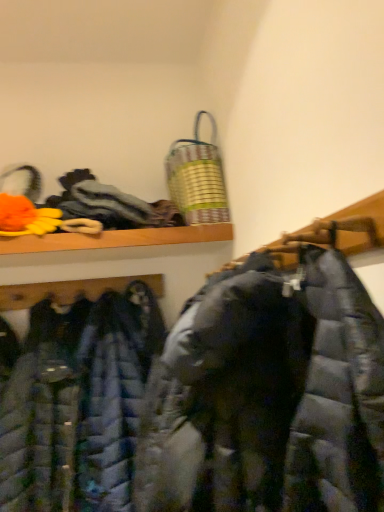
Describe the element at coordinates (241, 381) in the screenshot. The image size is (384, 512). I see `matte black puffer coat at center, which is the 2th cloak from top to bottom` at that location.

The width and height of the screenshot is (384, 512). What are the coordinates of `textured gray cloth at upper left, which is the first cloak in top-to-bottom order` in the screenshot? It's located at (110, 204).

Considering the positions of objects metallic striped laundry basket at upper center and matte blue puffer jacket at center, placed as the second jacket when sorted from front to back, in the image provided, who is more to the right, metallic striped laundry basket at upper center or matte blue puffer jacket at center, placed as the second jacket when sorted from front to back,?

metallic striped laundry basket at upper center.

Is point (210, 199) positioned before point (78, 498)?

No, it is not.

Is metallic striped laundry basket at upper center outside of matte blue puffer jacket at center, placed as the second jacket when sorted from front to back?

Yes, metallic striped laundry basket at upper center is outside of matte blue puffer jacket at center, placed as the second jacket when sorted from front to back.

Can you see metallic striped laundry basket at upper center touching matte blue puffer jacket at center, the 1th jacket in the back-to-front sequence?

No, metallic striped laundry basket at upper center is not next to matte blue puffer jacket at center, the 1th jacket in the back-to-front sequence.

From the image's perspective, is matte black puffer jacket at center, which appears as the first jacket when viewed from the front, below matte black puffer coat at center, which is the 2th cloak from top to bottom?

Actually, matte black puffer jacket at center, which appears as the first jacket when viewed from the front, appears above matte black puffer coat at center, which is the 2th cloak from top to bottom, in the image.

Considering the relative sizes of matte black puffer jacket at center, which appears as the first jacket when viewed from the front, and matte black puffer coat at center, which is the 2th cloak from top to bottom, in the image provided, is matte black puffer jacket at center, which appears as the first jacket when viewed from the front, smaller than matte black puffer coat at center, which is the 2th cloak from top to bottom,?

No.

Between matte black puffer jacket at center, which appears as the first jacket when viewed from the front, and matte black puffer coat at center, which is the 2th cloak from top to bottom, which one is positioned behind?

matte black puffer coat at center, which is the 2th cloak from top to bottom, is further from the camera.

Is point (209, 388) farther from viewer compared to point (72, 349)?

No, it is in front of (72, 349).

From a real-world perspective, between matte black puffer jacket at center, which appears as the first jacket when viewed from the front, and matte blue puffer jacket at center, placed as the second jacket when sorted from front to back, who is vertically lower?

matte blue puffer jacket at center, placed as the second jacket when sorted from front to back, from a real-world perspective.

From the picture: Can we say matte black puffer jacket at center, which appears as the first jacket when viewed from the front, lies outside matte blue puffer jacket at center, the 1th jacket in the back-to-front sequence?

matte black puffer jacket at center, which appears as the first jacket when viewed from the front, lies outside matte blue puffer jacket at center, the 1th jacket in the back-to-front sequence,'s area.

Considering the positions of objects matte black puffer jacket at center, which appears as the first jacket when viewed from the front, and matte blue puffer jacket at center, the 1th jacket in the back-to-front sequence, in the image provided, who is behind, matte black puffer jacket at center, which appears as the first jacket when viewed from the front, or matte blue puffer jacket at center, the 1th jacket in the back-to-front sequence,?

Positioned behind is matte blue puffer jacket at center, the 1th jacket in the back-to-front sequence.

Is metallic striped laundry basket at upper center to the left or to the right of textured gray cloth at upper left, which is the first cloak in top-to-bottom order, in the image?

metallic striped laundry basket at upper center is to the right of textured gray cloth at upper left, which is the first cloak in top-to-bottom order.

Considering the sizes of metallic striped laundry basket at upper center and textured gray cloth at upper left, arranged as the second cloak when ordered from the bottom, in the image, is metallic striped laundry basket at upper center wider or thinner than textured gray cloth at upper left, arranged as the second cloak when ordered from the bottom,?

metallic striped laundry basket at upper center is thinner than textured gray cloth at upper left, arranged as the second cloak when ordered from the bottom.

Is textured gray cloth at upper left, arranged as the second cloak when ordered from the bottom, at the right side of metallic striped laundry basket at upper center?

Incorrect, textured gray cloth at upper left, arranged as the second cloak when ordered from the bottom, is not on the right side of metallic striped laundry basket at upper center.

Between textured gray cloth at upper left, arranged as the second cloak when ordered from the bottom, and metallic striped laundry basket at upper center, which one is positioned behind?

metallic striped laundry basket at upper center is further away from the camera.

Does textured gray cloth at upper left, which is the first cloak in top-to-bottom order, turn towards metallic striped laundry basket at upper center?

No, textured gray cloth at upper left, which is the first cloak in top-to-bottom order, is not oriented towards metallic striped laundry basket at upper center.

Is textured gray cloth at upper left, which is the first cloak in top-to-bottom order, positioned far away from metallic striped laundry basket at upper center?

That's not correct — textured gray cloth at upper left, which is the first cloak in top-to-bottom order, is a little close to metallic striped laundry basket at upper center.

At what (x,y) coordinates should I click in order to perform the action: click on the 2nd jacket in front of the textured gray cloth at upper left, which is the first cloak in top-to-bottom order, starting your count from the anchor. Please return your answer as a coordinate pair (x, y). Image resolution: width=384 pixels, height=512 pixels. Looking at the image, I should click on (201, 398).

Which object is wider, textured gray cloth at upper left, arranged as the second cloak when ordered from the bottom, or matte black puffer jacket at center, which appears as the second jacket when viewed from the back?

matte black puffer jacket at center, which appears as the second jacket when viewed from the back, is wider.

Could matte black puffer jacket at center, which appears as the second jacket when viewed from the back, be considered to be inside textured gray cloth at upper left, arranged as the second cloak when ordered from the bottom?

No, matte black puffer jacket at center, which appears as the second jacket when viewed from the back, is not a part of textured gray cloth at upper left, arranged as the second cloak when ordered from the bottom.

What's the angular difference between textured gray cloth at upper left, which is the first cloak in top-to-bottom order, and matte black puffer jacket at center, which appears as the first jacket when viewed from the front,'s facing directions?

92.5 degrees.

From a real-world perspective, relative to matte black puffer jacket at center, which appears as the first jacket when viewed from the front, is metallic striped laundry basket at upper center vertically above or below?

In terms of real-world spatial position, metallic striped laundry basket at upper center is above matte black puffer jacket at center, which appears as the first jacket when viewed from the front.

Which object is thinner, metallic striped laundry basket at upper center or matte black puffer jacket at center, which appears as the second jacket when viewed from the back?

metallic striped laundry basket at upper center is thinner.

At what (x,y) coordinates should I click in order to perform the action: click on jacket that is the 2nd one when counting downward from the metallic striped laundry basket at upper center (from the image's perspective). Please return your answer as a coordinate pair (x, y). Looking at the image, I should click on (76, 401).

You are a GUI agent. You are given a task and a screenshot of the screen. Output one action in this format:
    pyautogui.click(x=<x>, y=<y>)
    Task: Click on the jacket in front of the matte black puffer coat at center, the 1th cloak ordered from the bottom
    The width and height of the screenshot is (384, 512).
    Given the screenshot: What is the action you would take?
    pyautogui.click(x=201, y=398)

Looking at the image, which one is located closer to metallic striped laundry basket at upper center, matte blue puffer jacket at center, placed as the second jacket when sorted from front to back, or matte black puffer jacket at center, which appears as the second jacket when viewed from the back?

matte black puffer jacket at center, which appears as the second jacket when viewed from the back, is positioned closer to the anchor metallic striped laundry basket at upper center.

Considering their positions, is matte blue puffer jacket at center, the 1th jacket in the back-to-front sequence, positioned further to textured gray cloth at upper left, which is the first cloak in top-to-bottom order, than matte black puffer jacket at center, which appears as the first jacket when viewed from the front?

Among the two, matte blue puffer jacket at center, the 1th jacket in the back-to-front sequence, is located further to textured gray cloth at upper left, which is the first cloak in top-to-bottom order.

When comparing their distances from matte blue puffer jacket at center, the 1th jacket in the back-to-front sequence, does metallic striped laundry basket at upper center or matte black puffer jacket at center, which appears as the second jacket when viewed from the back, seem closer?

matte black puffer jacket at center, which appears as the second jacket when viewed from the back, lies closer to matte blue puffer jacket at center, the 1th jacket in the back-to-front sequence, than the other object.

Considering their positions, is matte black puffer jacket at center, which appears as the first jacket when viewed from the front, positioned closer to matte black puffer coat at center, which is the 2th cloak from top to bottom, than metallic striped laundry basket at upper center?

matte black puffer jacket at center, which appears as the first jacket when viewed from the front, is closer to matte black puffer coat at center, which is the 2th cloak from top to bottom.

Estimate the real-world distances between objects in this image. Which object is closer to textured gray cloth at upper left, arranged as the second cloak when ordered from the bottom, matte blue puffer jacket at center, the 1th jacket in the back-to-front sequence, or matte black puffer coat at center, which is the 2th cloak from top to bottom?

The object closer to textured gray cloth at upper left, arranged as the second cloak when ordered from the bottom, is matte blue puffer jacket at center, the 1th jacket in the back-to-front sequence.

When comparing their distances from matte black puffer jacket at center, which appears as the second jacket when viewed from the back, does matte blue puffer jacket at center, the 1th jacket in the back-to-front sequence, or matte black puffer coat at center, which is the 2th cloak from top to bottom, seem further?

Among the two, matte black puffer coat at center, which is the 2th cloak from top to bottom, is located further to matte black puffer jacket at center, which appears as the second jacket when viewed from the back.

Which object lies further to the anchor point metallic striped laundry basket at upper center, matte black puffer coat at center, the 1th cloak ordered from the bottom, or textured gray cloth at upper left, arranged as the second cloak when ordered from the bottom?

The object further to metallic striped laundry basket at upper center is matte black puffer coat at center, the 1th cloak ordered from the bottom.

Based on their spatial positions, is metallic striped laundry basket at upper center or matte blue puffer jacket at center, the 1th jacket in the back-to-front sequence, closer to matte black puffer coat at center, which is the 2th cloak from top to bottom?

matte blue puffer jacket at center, the 1th jacket in the back-to-front sequence, lies closer to matte black puffer coat at center, which is the 2th cloak from top to bottom, than the other object.

The image size is (384, 512). What are the coordinates of `cloak that lies between metallic striped laundry basket at upper center and matte black puffer coat at center, the 1th cloak ordered from the bottom, from top to bottom` in the screenshot? It's located at (110, 204).

Where is `jacket positioned between matte black puffer jacket at center, which appears as the second jacket when viewed from the back, and textured gray cloth at upper left, which is the first cloak in top-to-bottom order, from near to far`? jacket positioned between matte black puffer jacket at center, which appears as the second jacket when viewed from the back, and textured gray cloth at upper left, which is the first cloak in top-to-bottom order, from near to far is located at coordinates (76, 401).

Where is `cloak between matte black puffer jacket at center, which appears as the first jacket when viewed from the front, and textured gray cloth at upper left, arranged as the second cloak when ordered from the bottom, from front to back`? cloak between matte black puffer jacket at center, which appears as the first jacket when viewed from the front, and textured gray cloth at upper left, arranged as the second cloak when ordered from the bottom, from front to back is located at coordinates (241, 381).

Find the location of a particular element. This screenshot has height=512, width=384. jacket between matte black puffer jacket at center, which appears as the first jacket when viewed from the front, and metallic striped laundry basket at upper center from front to back is located at coordinates (76, 401).